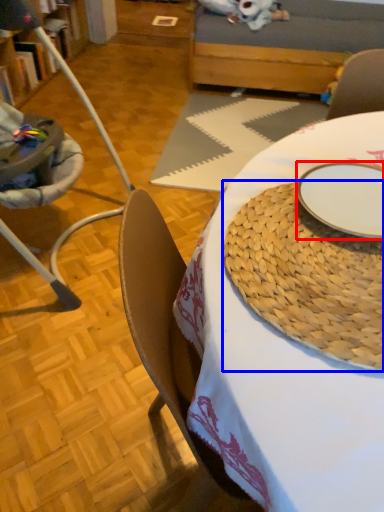
Question: Which object is closer to the camera taking this photo, plate (highlighted by a red box) or platter (highlighted by a blue box)?

Choices:
 (A) plate
 (B) platter

Answer: (B)